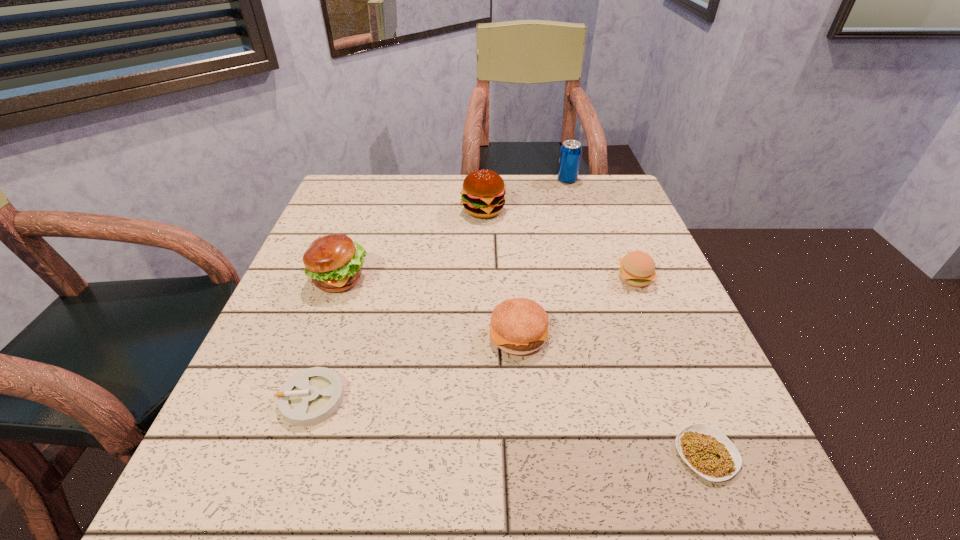
You are a GUI agent. You are given a task and a screenshot of the screen. Output one action in this format:
    pyautogui.click(x=<x>, y=<y>)
    Task: Click on the object that is the fourth closest to the leftmost hamburger
    The image size is (960, 540).
    Given the screenshot: What is the action you would take?
    pyautogui.click(x=637, y=268)

Where is `hamburger that is the closest to the pop soda`? Image resolution: width=960 pixels, height=540 pixels. hamburger that is the closest to the pop soda is located at coordinates (483, 195).

Locate an element on the screen. hamburger that stands as the closest to the nearest hamburger is located at coordinates (637, 268).

Identify the location of free spot that satisfies the following two spatial constraints: 1. on the back side of the rightmost hamburger; 2. on the right side of the leftmost hamburger. (340, 278).

Image resolution: width=960 pixels, height=540 pixels. I want to click on vacant space that satisfies the following two spatial constraints: 1. on the front side of the second shortest object; 2. on the left side of the leftmost hamburger, so point(296,399).

Locate an element on the screen. free point that satisfies the following two spatial constraints: 1. on the front side of the sixth tallest object; 2. on the left side of the leftmost hamburger is located at coordinates (296, 399).